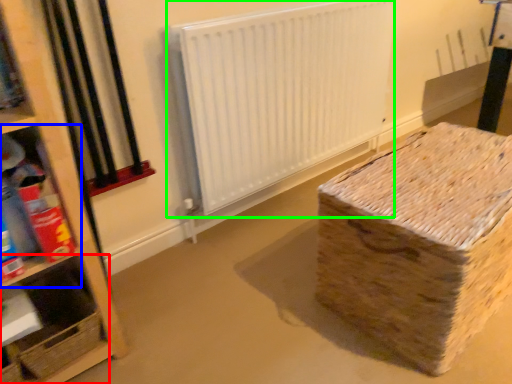
Question: Which is nearer to the shelf (highlighted by a red box)? shelf (highlighted by a blue box) or radiator (highlighted by a green box).

Choices:
 (A) shelf
 (B) radiator

Answer: (A)